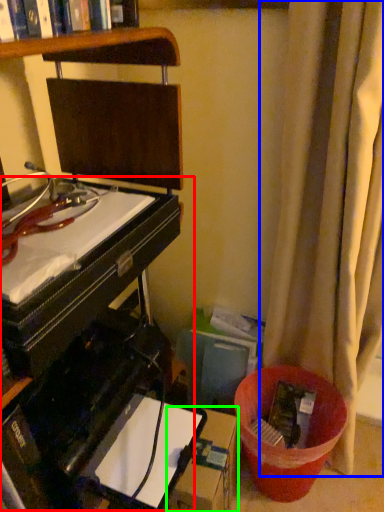
Question: Which is farther away from computer desk (highlighted by a red box)? curtain (highlighted by a blue box) or cardboard box (highlighted by a green box)?

Choices:
 (A) curtain
 (B) cardboard box

Answer: (A)